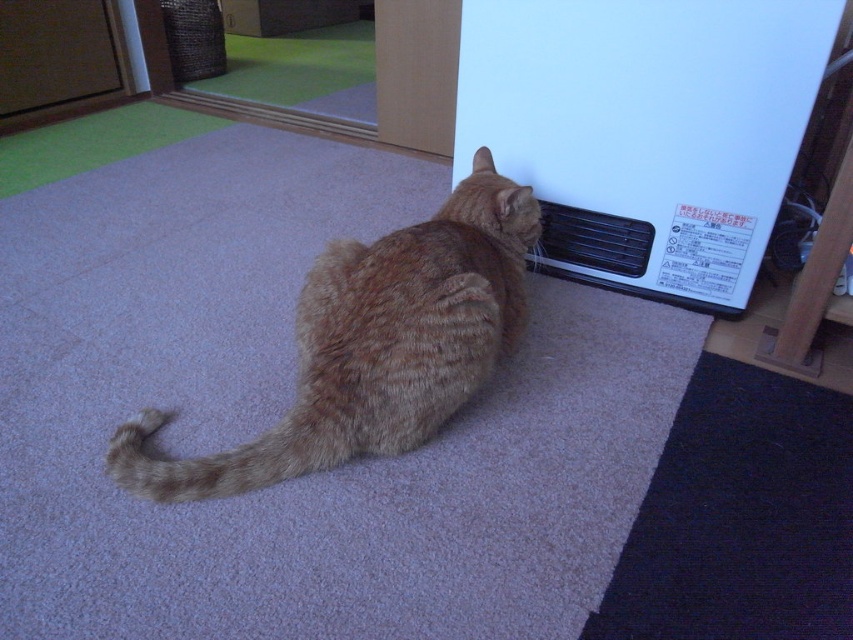
Question: Which object appears closest to the camera in this image?

Choices:
 (A) orange tabby cat at center
 (B) white plastic heater at lower right

Answer: (A)

Question: Considering the relative positions of white plastic heater at lower right and orange tabby cat at center in the image provided, where is white plastic heater at lower right located with respect to orange tabby cat at center?

Choices:
 (A) right
 (B) left

Answer: (A)

Question: Where is white plastic heater at lower right located in relation to orange tabby cat at center in the image?

Choices:
 (A) above
 (B) below

Answer: (A)

Question: Considering the relative positions of white plastic heater at lower right and orange tabby cat at center in the image provided, where is white plastic heater at lower right located with respect to orange tabby cat at center?

Choices:
 (A) left
 (B) right

Answer: (B)